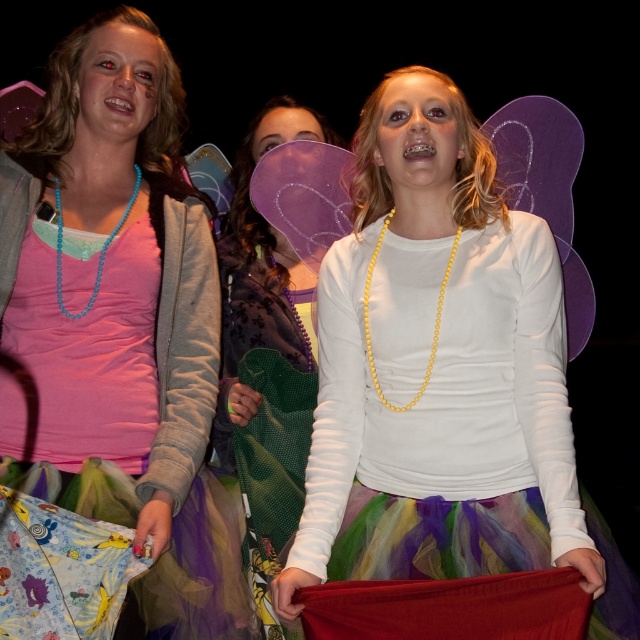
Which is more to the right, purple glitter fairy wings at center or turquoise beaded necklace at left?

From the viewer's perspective, purple glitter fairy wings at center appears more on the right side.

Is point (282, 385) closer to viewer compared to point (104, 256)?

No, it is not.

Is point (252, 552) farther from viewer compared to point (100, 248)?

Yes, point (252, 552) is farther from viewer.

Locate an element on the screen. purple glitter fairy wings at center is located at coordinates (266, 358).

Between point (68, 266) and point (243, 330), which one is positioned in front?

Point (68, 266) is more forward.

Who is more forward, (136, 448) or (266, 564)?

Point (136, 448) is in front.

The image size is (640, 640). I want to click on matte pink tulle skirt at lower left, so click(x=120, y=310).

Does matte pink tulle skirt at lower left have a lesser width compared to turquoise beaded necklace at left?

Incorrect, matte pink tulle skirt at lower left's width is not less than turquoise beaded necklace at left's.

Find the location of a particular element. The height and width of the screenshot is (640, 640). matte pink tulle skirt at lower left is located at coordinates (120, 310).

Is point (99, 212) closer to camera compared to point (93, 298)?

No.

In order to click on matte pink tulle skirt at lower left in this screenshot , I will do `click(120, 310)`.